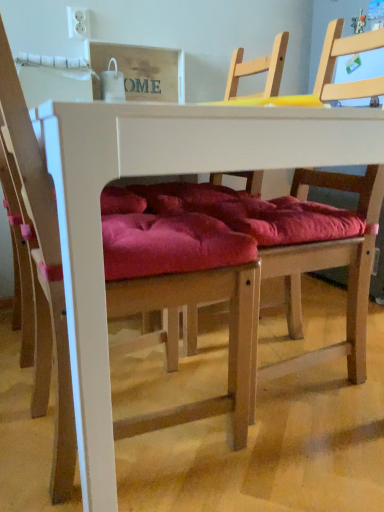
Describe the element at coordinates (258, 68) in the screenshot. I see `wooden chair at center, the 2th chair from the left` at that location.

What do you see at coordinates (165, 173) in the screenshot?
I see `white matte table at center` at bounding box center [165, 173].

Where is `wooden chair at center, the 2th chair from the left`? Image resolution: width=384 pixels, height=512 pixels. wooden chair at center, the 2th chair from the left is located at coordinates (258, 68).

Consider the image. Would you say wooden chair at center, the 2th chair from the left, is part of velvet red cushion at center, the first chair positioned from the left,'s contents?

That's incorrect, wooden chair at center, the 2th chair from the left, is not inside velvet red cushion at center, the first chair positioned from the left.

Where is `chair above the velvet red cushion at center, placed as the 2th chair when sorted from right to left (from the image's perspective)`? The width and height of the screenshot is (384, 512). chair above the velvet red cushion at center, placed as the 2th chair when sorted from right to left (from the image's perspective) is located at coordinates (258, 68).

Is point (150, 417) closer to camera compared to point (338, 86)?

Yes, point (150, 417) is in front of point (338, 86).

From the image's perspective, is white matte table at center above wooden chair at center, placed as the first chair when sorted from right to left?

Incorrect, from the image's perspective, white matte table at center is lower than wooden chair at center, placed as the first chair when sorted from right to left.

Between white matte table at center and wooden chair at center, the 2th chair from the left, which one has smaller width?

With smaller width is wooden chair at center, the 2th chair from the left.

Can we say white matte table at center lies outside wooden chair at center, the 2th chair from the left?

Yes, white matte table at center is not within wooden chair at center, the 2th chair from the left.

Could you measure the distance between wooden chair at center, placed as the first chair when sorted from right to left, and velvet red cushion at center, the first chair positioned from the left?

wooden chair at center, placed as the first chair when sorted from right to left, and velvet red cushion at center, the first chair positioned from the left, are 1.03 meters apart.

Is wooden chair at center, placed as the first chair when sorted from right to left, oriented away from velvet red cushion at center, placed as the 2th chair when sorted from right to left?

wooden chair at center, placed as the first chair when sorted from right to left, is not turned away from velvet red cushion at center, placed as the 2th chair when sorted from right to left.

Which object is positioned more to the right, wooden chair at center, the 2th chair from the left, or velvet red cushion at center, placed as the 2th chair when sorted from right to left?

wooden chair at center, the 2th chair from the left, is more to the right.

Consider the image. Considering the sizes of objects wooden chair at center, the 2th chair from the left, and velvet red cushion at center, placed as the 2th chair when sorted from right to left, in the image provided, who is thinner, wooden chair at center, the 2th chair from the left, or velvet red cushion at center, placed as the 2th chair when sorted from right to left,?

With smaller width is velvet red cushion at center, placed as the 2th chair when sorted from right to left.

From the image's perspective, is velvet red cushion at center, placed as the 2th chair when sorted from right to left, positioned above or below white matte table at center?

velvet red cushion at center, placed as the 2th chair when sorted from right to left, is above white matte table at center.

Is point (123, 430) in front of point (67, 103)?

No, (123, 430) is further to viewer.

Which of these two, velvet red cushion at center, the first chair positioned from the left, or white matte table at center, stands shorter?

Standing shorter between the two is white matte table at center.

Considering the positions of objects wooden chair at center, the 2th chair from the left, and white matte table at center in the image provided, who is more to the right, wooden chair at center, the 2th chair from the left, or white matte table at center?

Positioned to the right is wooden chair at center, the 2th chair from the left.

Would you say wooden chair at center, placed as the first chair when sorted from right to left, is inside or outside white matte table at center?

wooden chair at center, placed as the first chair when sorted from right to left, is enclosed within white matte table at center.

Locate an element on the screen. Image resolution: width=384 pixels, height=512 pixels. table below the velvet red cushion at center, placed as the 2th chair when sorted from right to left (from a real-world perspective) is located at coordinates (165, 173).

Measure the distance between white matte table at center and velvet red cushion at center, the first chair positioned from the left.

white matte table at center and velvet red cushion at center, the first chair positioned from the left, are 8.81 inches apart from each other.

Which is behind, point (174, 142) or point (163, 279)?

The point (163, 279) is farther from the camera.

Can you confirm if white matte table at center is thinner than velvet red cushion at center, the first chair positioned from the left?

No.

You are a GUI agent. You are given a task and a screenshot of the screen. Output one action in this format:
    pyautogui.click(x=<x>, y=<y>)
    Task: Click on the chair on the right of the velvet red cushion at center, the first chair positioned from the left
    
    Given the screenshot: What is the action you would take?
    pyautogui.click(x=258, y=68)

You are a GUI agent. You are given a task and a screenshot of the screen. Output one action in this format:
    pyautogui.click(x=<x>, y=<y>)
    Task: Click on the 2nd chair above the white matte table at center (from the image's perspective)
    The height and width of the screenshot is (512, 384).
    Given the screenshot: What is the action you would take?
    pyautogui.click(x=258, y=68)

Based on their spatial positions, is velvet red cushion at center, the first chair positioned from the left, or wooden chair at center, placed as the first chair when sorted from right to left, closer to white matte table at center?

Based on the image, velvet red cushion at center, the first chair positioned from the left, appears to be nearer to white matte table at center.

Based on the photo, looking at the image, which one is located closer to wooden chair at center, the 2th chair from the left, white matte table at center or velvet red cushion at center, placed as the 2th chair when sorted from right to left?

velvet red cushion at center, placed as the 2th chair when sorted from right to left.

Estimate the real-world distances between objects in this image. Which object is further from wooden chair at center, the 2th chair from the left, velvet red cushion at center, the first chair positioned from the left, or white matte table at center?

Based on the image, white matte table at center appears to be further to wooden chair at center, the 2th chair from the left.

From the image, which object appears to be farther from velvet red cushion at center, the first chair positioned from the left, wooden chair at center, placed as the first chair when sorted from right to left, or white matte table at center?

Based on the image, wooden chair at center, placed as the first chair when sorted from right to left, appears to be further to velvet red cushion at center, the first chair positioned from the left.

Consider the image. Estimate the real-world distances between objects in this image. Which object is closer to white matte table at center, wooden chair at center, placed as the first chair when sorted from right to left, or velvet red cushion at center, the first chair positioned from the left?

velvet red cushion at center, the first chair positioned from the left, is positioned closer to the anchor white matte table at center.

Which object lies nearer to the anchor point velvet red cushion at center, the first chair positioned from the left, white matte table at center or wooden chair at center, the 2th chair from the left?

white matte table at center is closer to velvet red cushion at center, the first chair positioned from the left.

This screenshot has height=512, width=384. Identify the location of table between velvet red cushion at center, placed as the 2th chair when sorted from right to left, and wooden chair at center, placed as the first chair when sorted from right to left. (165, 173).